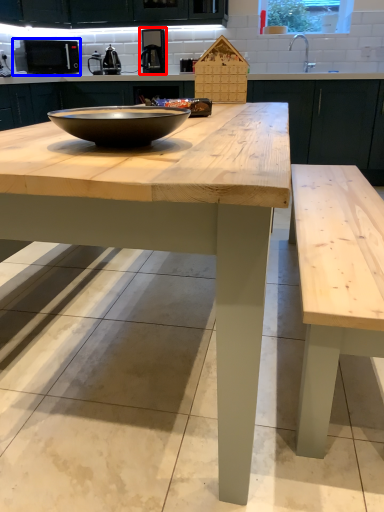
Question: Among these objects, which one is nearest to the camera, coffee machine (highlighted by a red box) or appliance (highlighted by a blue box)?

Choices:
 (A) coffee machine
 (B) appliance

Answer: (A)